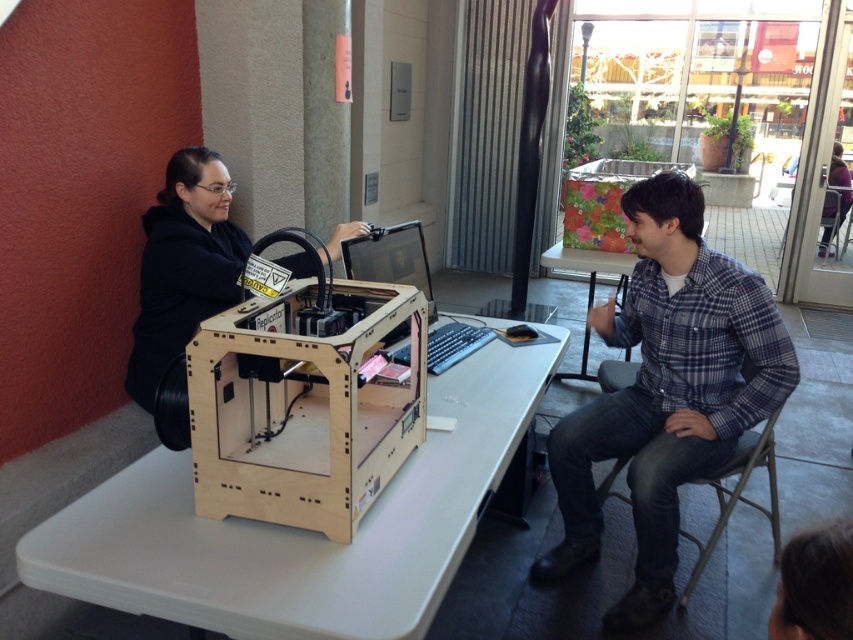
Who is more forward, (245, 522) or (178, 243)?

Positioned in front is point (245, 522).

Who is shorter, light wood table at center or black matte 3d printer at left?

With less height is light wood table at center.

The width and height of the screenshot is (853, 640). What are the coordinates of `light wood table at center` in the screenshot? It's located at (299, 529).

This screenshot has height=640, width=853. I want to click on light wood table at center, so click(299, 529).

Is black matte 3d printer at left positioned behind matte black laptop at center?

Yes, it is.

Is black matte 3d printer at left to the left of matte black laptop at center from the viewer's perspective?

Yes, black matte 3d printer at left is to the left of matte black laptop at center.

Is point (135, 358) positioned before point (390, 260)?

That is False.

At what (x,y) coordinates should I click in order to perform the action: click on black matte 3d printer at left. Please return your answer as a coordinate pair (x, y). This screenshot has width=853, height=640. Looking at the image, I should click on (183, 266).

Is plaid flannel shirt at right closer to camera compared to black matte 3d printer at left?

That is True.

Who is positioned more to the left, plaid flannel shirt at right or black matte 3d printer at left?

black matte 3d printer at left is more to the left.

Locate an element on the screen. plaid flannel shirt at right is located at coordinates (666, 392).